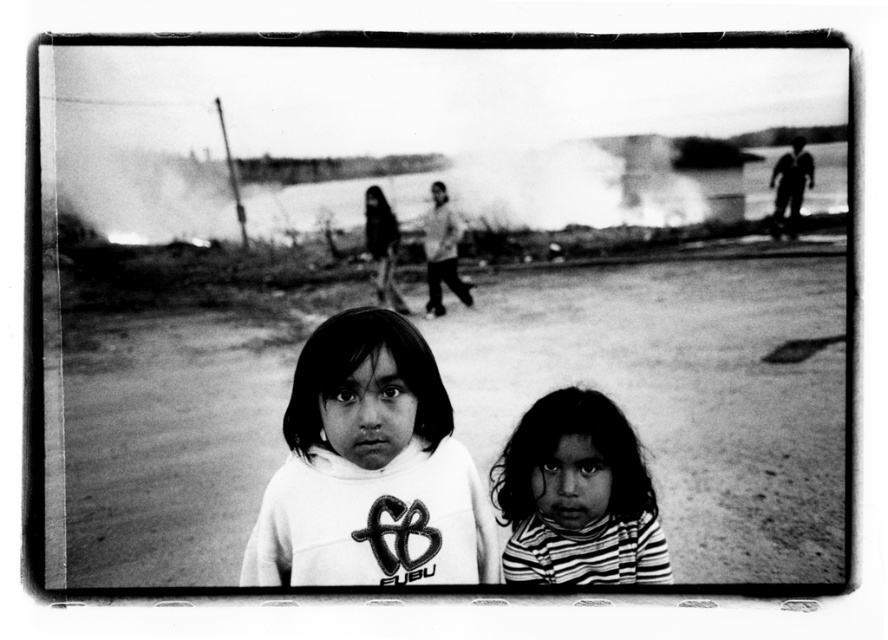
You are a photographer trying to capture a shot of the two children in the scene. You notice two points marked as point 1 at coordinates (456, 467) and point 2 at coordinates (498, 461). Which point is closer to the camera where you are standing?

Point 1 at coordinates (456, 467) is closer to the camera because it is in front of point 2 at coordinates (498, 461).

You are a photographer trying to focus on the closest object between the white soft sweatshirt at center and the striped fabric shirt at lower right. Which one should you adjust your camera to focus on?

The white soft sweatshirt at center is closer to the viewer than the striped fabric shirt at lower right, so you should focus your camera on the white soft sweatshirt at center.

You are a photographer trying to capture a group shot of the children in the scene. You want to ensure that both the white soft sweatshirt at center and the striped fabric shirt at lower right are in focus. Given that your camera can only focus on objects within a 5 inch range, will both subjects be in focus?

The white soft sweatshirt at center is 7.53 inches from the striped fabric shirt at lower right. Since the distance between them exceeds the camera focus range of 5 inches, they cannot both be in focus simultaneously.